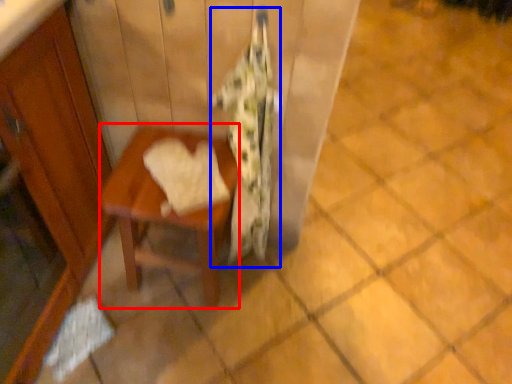
Question: Which point is further to the camera, table (highlighted by a red box) or blanket (highlighted by a blue box)?

Choices:
 (A) table
 (B) blanket

Answer: (A)